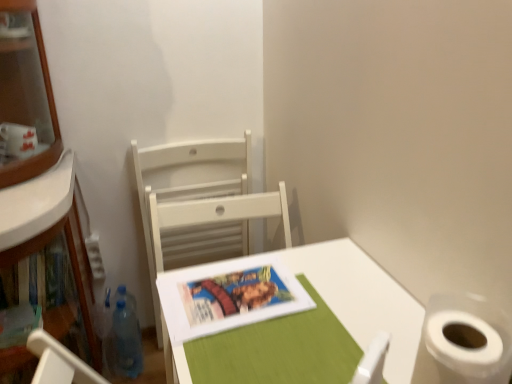
Image resolution: width=512 pixels, height=384 pixels. I want to click on white matte table at center, so click(362, 299).

Where is `transparent plastic bottle at lower left`? The image size is (512, 384). transparent plastic bottle at lower left is located at coordinates (124, 338).

Describe the element at coordinates (189, 203) in the screenshot. I see `white wood chair at center` at that location.

The image size is (512, 384). I want to click on white matte table at center, so pos(362,299).

Which is correct: transparent plastic bottle at lower left is inside matte paper book cover at center, or outside of it?

transparent plastic bottle at lower left is not inside matte paper book cover at center, it's outside.

Looking at their sizes, would you say transparent plastic bottle at lower left is wider or thinner than matte paper book cover at center?

→ In the image, transparent plastic bottle at lower left appears to be more narrow than matte paper book cover at center.

Who is bigger, transparent plastic bottle at lower left or matte paper book cover at center?

transparent plastic bottle at lower left.

Find the location of a particular element. The height and width of the screenshot is (384, 512). bottle that appears below the matte paper book cover at center (from the image's perspective) is located at coordinates (124, 338).

From a real-world perspective, which is physically above, white wood chair at center or matte paper book cover at center?

In real-world perspective, matte paper book cover at center is above.

From the image's perspective, which is below, white wood chair at center or matte paper book cover at center?

matte paper book cover at center, from the image's perspective.

Is matte paper book cover at center at the back of white wood chair at center?

No, white wood chair at center is not facing away from matte paper book cover at center.

Is point (220, 151) closer or farther from the camera than point (274, 286)?

Point (220, 151) is farther from the camera than point (274, 286).

Is white matte table at center taller or shorter than white wood chair at center?

white matte table at center is shorter than white wood chair at center.

Is white matte table at center positioned far away from white wood chair at center?

No, white matte table at center is not far from white wood chair at center.

What's the angular difference between white matte table at center and white wood chair at center's facing directions?

The angular difference between white matte table at center and white wood chair at center is 90.2 degrees.

Is transparent plastic bottle at lower left oriented away from white wood chair at center?

No, transparent plastic bottle at lower left is not facing away from white wood chair at center.

Consider the image. Is transparent plastic bottle at lower left closer to camera compared to white wood chair at center?

No, transparent plastic bottle at lower left is further to the viewer.

At what (x,y) coordinates should I click in order to perform the action: click on bottle below the white wood chair at center (from the image's perspective). Please return your answer as a coordinate pair (x, y). The width and height of the screenshot is (512, 384). Looking at the image, I should click on (124, 338).

From a real-world perspective, which object rests below the other?

Result: transparent plastic bottle at lower left.

Is transparent plastic bottle at lower left shorter than white matte table at center?

In fact, transparent plastic bottle at lower left may be taller than white matte table at center.

Is transparent plastic bottle at lower left far from white matte table at center?

No, there isn't a large distance between transparent plastic bottle at lower left and white matte table at center.

The width and height of the screenshot is (512, 384). Identify the location of table above the transparent plastic bottle at lower left (from the image's perspective). (362, 299).

Consider the image. Between transparent plastic bottle at lower left and white matte table at center, which one appears on the right side from the viewer's perspective?

white matte table at center is more to the right.

Can we say matte paper book cover at center lies outside transparent plastic bottle at lower left?

matte paper book cover at center is positioned outside transparent plastic bottle at lower left.

Which object is further away from the camera taking this photo, matte paper book cover at center or transparent plastic bottle at lower left?

Positioned behind is transparent plastic bottle at lower left.

From a real-world perspective, which is physically above, matte paper book cover at center or transparent plastic bottle at lower left?

From a 3D spatial view, matte paper book cover at center is above.

From the image's perspective, does matte paper book cover at center appear higher than transparent plastic bottle at lower left?

Yes, from the image's perspective, matte paper book cover at center is on top of transparent plastic bottle at lower left.

Find the location of a particular element. This screenshot has width=512, height=384. bottle behind the white wood chair at center is located at coordinates (124, 338).

Which of these two, white wood chair at center or transparent plastic bottle at lower left, is bigger?

With larger size is white wood chair at center.

Does white wood chair at center have a greater height compared to transparent plastic bottle at lower left?

Yes.

Between white wood chair at center and transparent plastic bottle at lower left, which one is positioned behind?

transparent plastic bottle at lower left is behind.

In the image, there is a matte paper book cover at center. Identify the location of bottle below it (from the image's perspective). (124, 338).

The height and width of the screenshot is (384, 512). In order to click on book cover in front of the white wood chair at center in this screenshot , I will do [x=232, y=294].

Considering their positions, is matte paper book cover at center positioned closer to white wood chair at center than white matte table at center?

matte paper book cover at center.

When comparing their distances from matte paper book cover at center, does transparent plastic bottle at lower left or white wood chair at center seem closer?

white wood chair at center lies closer to matte paper book cover at center than the other object.

Which object lies nearer to the anchor point white wood chair at center, white matte table at center or matte paper book cover at center?

matte paper book cover at center is closer to white wood chair at center.

From the image, which object appears to be nearer to white wood chair at center, transparent plastic bottle at lower left or matte paper book cover at center?

Based on the image, transparent plastic bottle at lower left appears to be nearer to white wood chair at center.

Based on their spatial positions, is transparent plastic bottle at lower left or white matte table at center closer to white wood chair at center?

transparent plastic bottle at lower left lies closer to white wood chair at center than the other object.

From the image, which object appears to be farther from white matte table at center, transparent plastic bottle at lower left or matte paper book cover at center?

transparent plastic bottle at lower left is positioned further to the anchor white matte table at center.

Looking at the image, which one is located further to transparent plastic bottle at lower left, white wood chair at center or white matte table at center?

Based on the image, white matte table at center appears to be further to transparent plastic bottle at lower left.

Consider the image. Estimate the real-world distances between objects in this image. Which object is closer to white wood chair at center, matte paper book cover at center or transparent plastic bottle at lower left?

transparent plastic bottle at lower left is positioned closer to the anchor white wood chair at center.

Find the location of `chair between white matte table at center and transparent plastic bottle at lower left along the z-axis`. chair between white matte table at center and transparent plastic bottle at lower left along the z-axis is located at coordinates pyautogui.click(x=189, y=203).

Where is `chair positioned between matte paper book cover at center and transparent plastic bottle at lower left from near to far`? chair positioned between matte paper book cover at center and transparent plastic bottle at lower left from near to far is located at coordinates (189, 203).

I want to click on book cover between white matte table at center and transparent plastic bottle at lower left in the front-back direction, so click(232, 294).

The width and height of the screenshot is (512, 384). Identify the location of book cover positioned between white matte table at center and white wood chair at center from near to far. (232, 294).